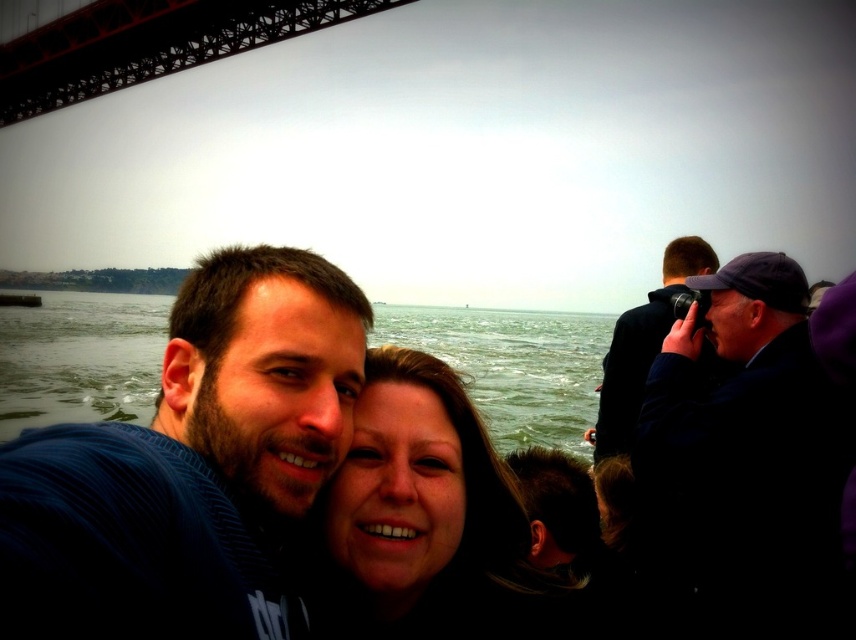
You are standing at the point marked by coordinates point [138,42] in the image. Looking towards the bridge, what direction would you face?

The point [138,42] corresponds to the metallic bridge at upper left, so facing towards the bridge from that point would mean looking towards the upper left direction.

You are a photographer trying to capture a photo of the smooth skin face at center and the black fabric camera at right. Based on their positions, which object should you focus on first if you want to ensure both are in the frame?

The smooth skin face at center is to the left of the black fabric camera at right, so you should focus on the smooth skin face at center first to ensure both are in the frame.